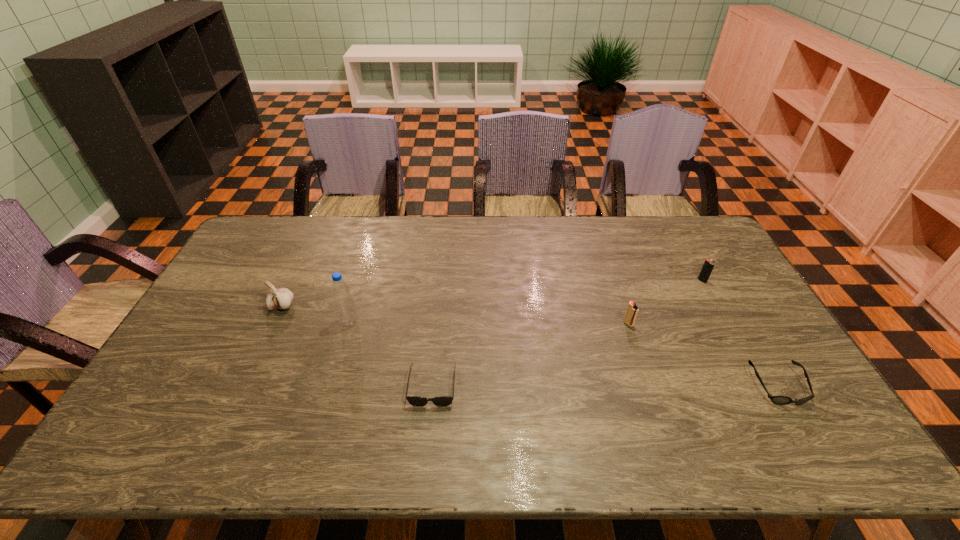
In order to click on free spot between the farther igniter and the second object from left to right in this screenshot , I will do `click(526, 301)`.

Locate an element on the screen. This screenshot has height=540, width=960. vacant space that is in between the water bottle and the farthest object is located at coordinates (526, 301).

The image size is (960, 540). I want to click on vacant space that's between the farther igniter and the leftmost object, so click(492, 293).

Locate an element on the screen. object that is the third nearest to the right sunglasses is located at coordinates (418, 401).

Identify which object is located as the third nearest to the leftmost object. Please provide its 2D coordinates. Your answer should be formatted as a tuple, i.e. [(x, y)], where the tuple contains the x and y coordinates of a point satisfying the conditions above.

[(632, 310)]